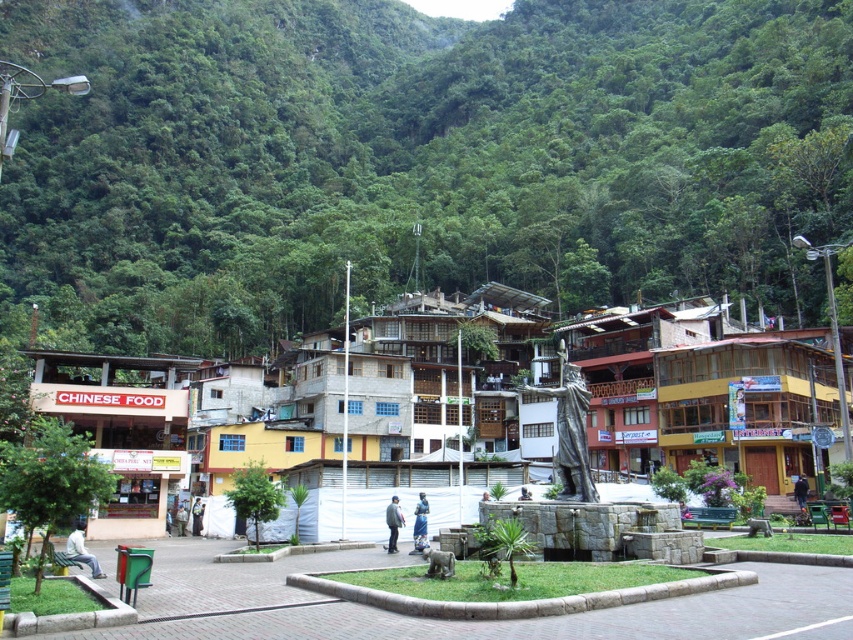
You are standing at the camera position and want to take a photo of the bronze statue at center. Given that your camera has a maximum zoom range of 100 feet, can you capture the statue without moving closer?

The bronze statue at center and camera are 98.98 feet apart, so yes, you can capture the statue without moving closer since the distance is within the camera maximum zoom range of 100 feet.

You are a tourist visiting this town and want to sit down to rest. You see the bronze statue at center and the light blue fabric bench at lower left. Which object is wider so you can choose the best spot to sit?

The light blue fabric bench at lower left is wider than the bronze statue at center, so you should choose the light blue fabric bench at lower left to sit since it has more space.